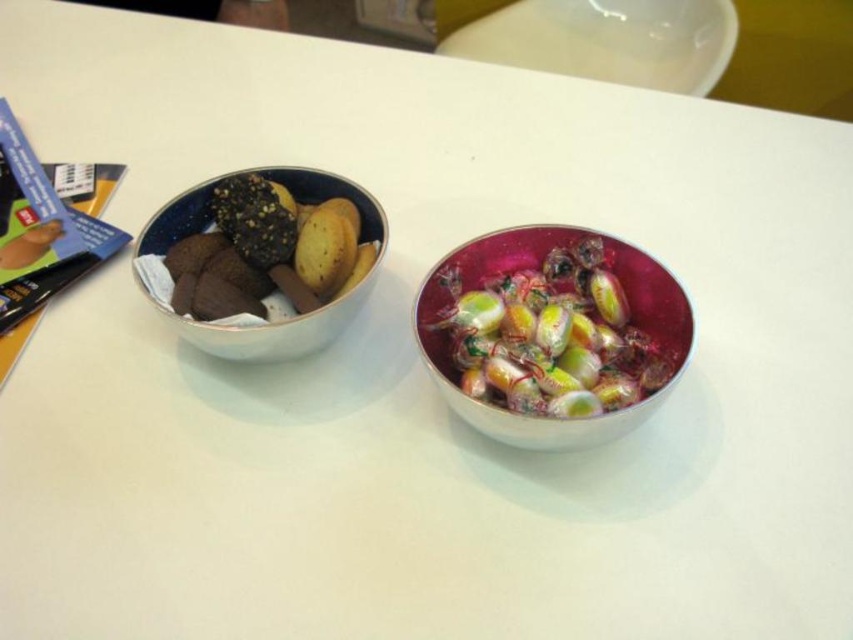
Is shiny metallic bowl at center further to camera compared to matte ceramic bowl at left?

No, it is in front of matte ceramic bowl at left.

Which is behind, point (682, 355) or point (173, 232)?

Positioned behind is point (173, 232).

Is point (428, 336) closer to viewer compared to point (173, 317)?

No.

The width and height of the screenshot is (853, 640). I want to click on shiny metallic bowl at center, so click(531, 266).